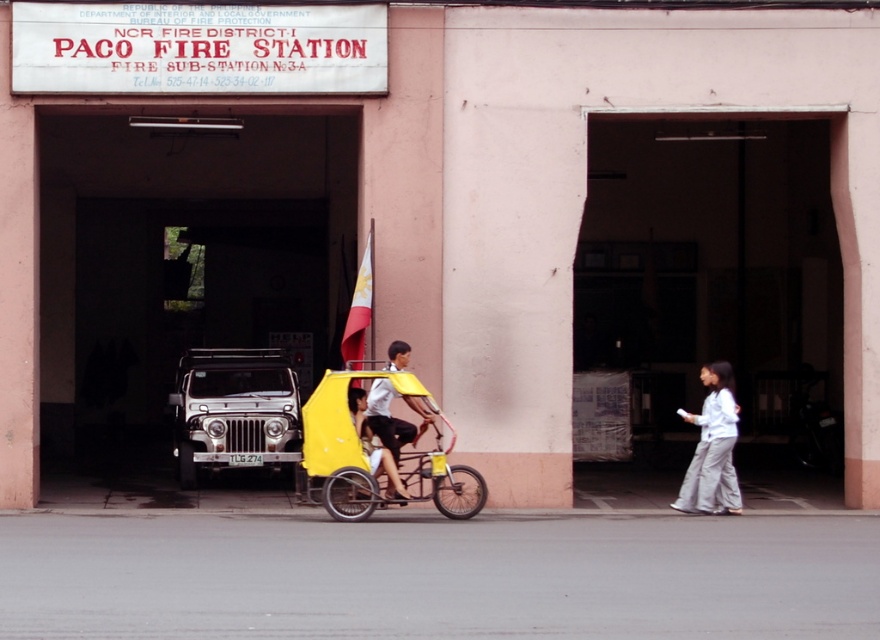
Question: Which point is farther to the camera?

Choices:
 (A) (722, 449)
 (B) (408, 497)
 (C) (423, 426)

Answer: (A)

Question: Does metallic silver jeep at center appear on the right side of light brown wooden cart at center?

Choices:
 (A) no
 (B) yes

Answer: (A)

Question: Is yellow matte tricycle at center smaller than white fabric pants at lower right?

Choices:
 (A) no
 (B) yes

Answer: (A)

Question: Considering the relative positions of metallic silver jeep at center and yellow matte cart at center in the image provided, where is metallic silver jeep at center located with respect to yellow matte cart at center?

Choices:
 (A) above
 (B) below

Answer: (B)

Question: Estimate the real-world distances between objects in this image. Which object is closer to the light brown wooden cart at center?

Choices:
 (A) yellow matte tricycle at center
 (B) yellow matte cart at center
 (C) metallic silver jeep at center
 (D) white fabric pants at lower right

Answer: (B)

Question: Which of the following is the closest to the observer?

Choices:
 (A) light brown wooden cart at center
 (B) yellow matte cart at center
 (C) white fabric pants at lower right
 (D) yellow matte tricycle at center

Answer: (D)